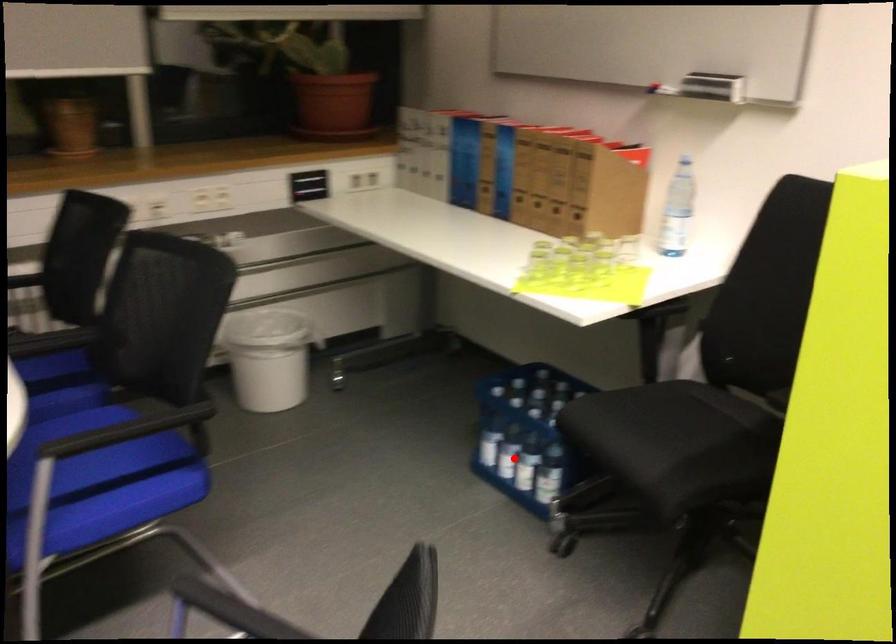
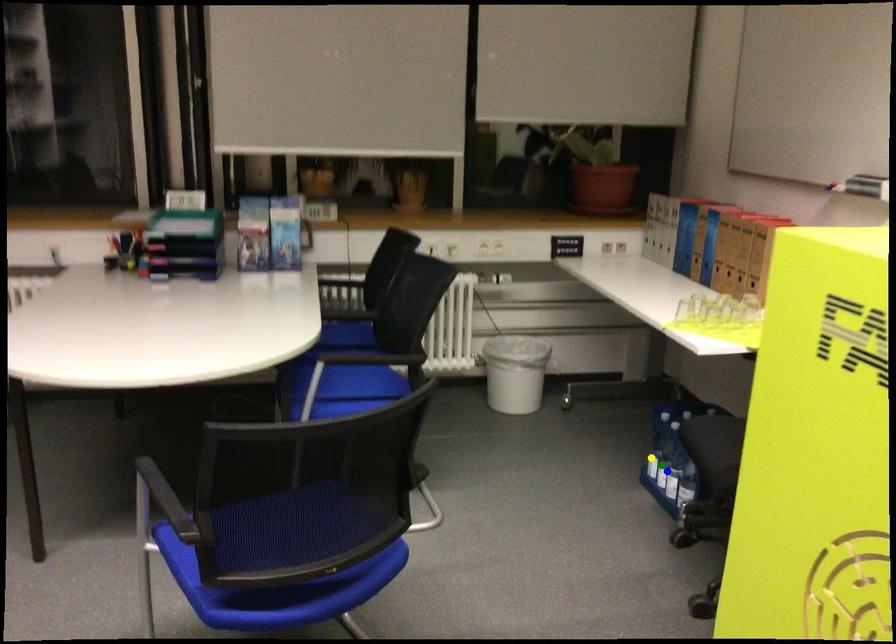
Question: I am providing you with two images of the same scene from different viewpoints. A red point is marked on the first image. You are given multiple points on the second image. Which point in image 2 is actually the same real-world point as the red point in image 1?

Choices:
 (A) green point
 (B) blue point
 (C) yellow point

Answer: (B)